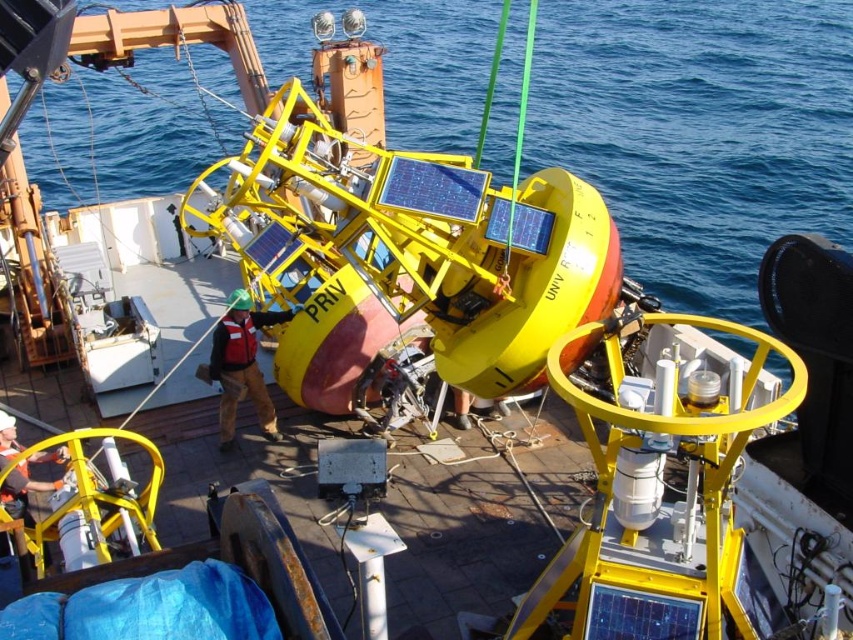
Question: Among these points, which one is nearest to the camera?

Choices:
 (A) [x=231, y=442]
 (B) [x=26, y=493]

Answer: (B)

Question: Can you confirm if hard hat helmet at center is positioned above brushed metal helmet at lower left?

Choices:
 (A) yes
 (B) no

Answer: (A)

Question: Which point is closer to the camera?

Choices:
 (A) brushed metal helmet at lower left
 (B) hard hat helmet at center

Answer: (A)

Question: Can you confirm if hard hat helmet at center is smaller than brushed metal helmet at lower left?

Choices:
 (A) yes
 (B) no

Answer: (B)

Question: Among these points, which one is nearest to the camera?

Choices:
 (A) (268, 321)
 (B) (16, 481)

Answer: (B)

Question: Is hard hat helmet at center smaller than brushed metal helmet at lower left?

Choices:
 (A) yes
 (B) no

Answer: (B)